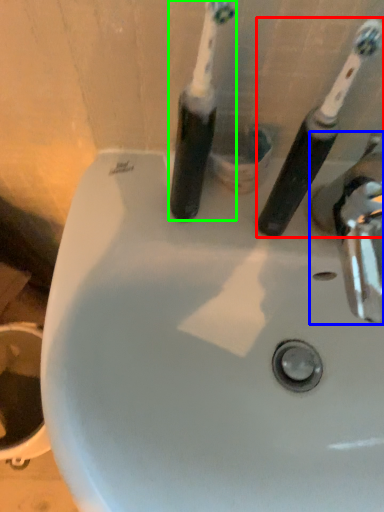
Question: Estimate the real-world distances between objects in this image. Which object is farther from toothbrush (highlighted by a red box), tap (highlighted by a blue box) or toothbrush (highlighted by a green box)?

Choices:
 (A) tap
 (B) toothbrush

Answer: (B)